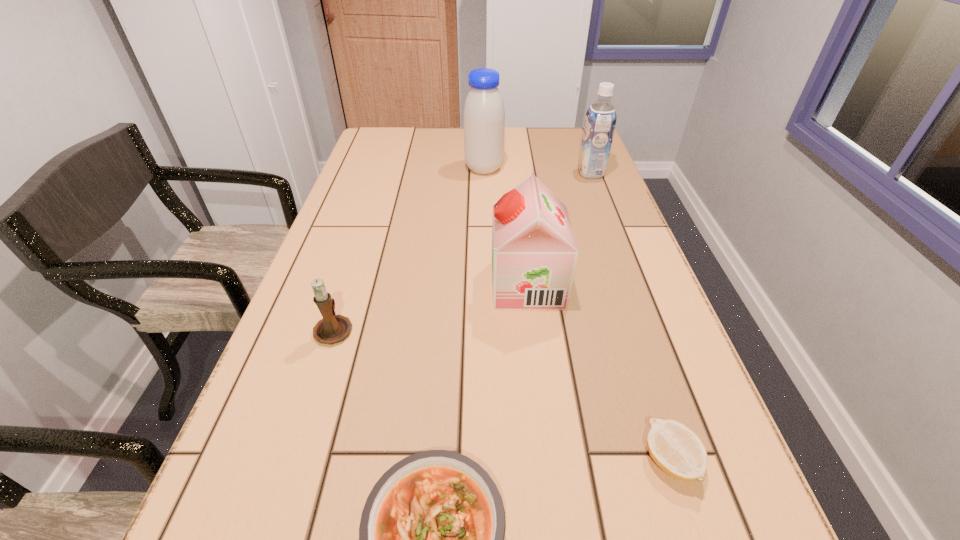
This screenshot has width=960, height=540. In order to click on vacant region at the right edge in this screenshot , I will do click(648, 265).

You are a GUI agent. You are given a task and a screenshot of the screen. Output one action in this format:
    pyautogui.click(x=<x>, y=<y>)
    Task: Click on the vacant space at the far left corner of the desktop
    
    Given the screenshot: What is the action you would take?
    pyautogui.click(x=372, y=129)

You are a GUI agent. You are given a task and a screenshot of the screen. Output one action in this format:
    pyautogui.click(x=<x>, y=<y>)
    Task: Click on the free spot between the leftmost object and the lemon
    The width and height of the screenshot is (960, 540).
    Given the screenshot: What is the action you would take?
    pyautogui.click(x=502, y=395)

This screenshot has width=960, height=540. Find the location of `free area in between the shortest object and the candle holder`. free area in between the shortest object and the candle holder is located at coordinates (502, 395).

Image resolution: width=960 pixels, height=540 pixels. Identify the location of free spot between the lemon and the candle holder. (502, 395).

Identify which object is the fourth closest to the nearest soya milk. Please provide its 2D coordinates. Your answer should be formatted as a tuple, i.e. [(x, y)], where the tuple contains the x and y coordinates of a point satisfying the conditions above.

[(484, 114)]

Where is `the closest object to the rightmost soya milk`? The image size is (960, 540). the closest object to the rightmost soya milk is located at coordinates [x=484, y=114].

You are a GUI agent. You are given a task and a screenshot of the screen. Output one action in this format:
    pyautogui.click(x=<x>, y=<y>)
    Task: Click on the soya milk that stands as the closest to the fourth tallest object
    This screenshot has height=540, width=960.
    Given the screenshot: What is the action you would take?
    pyautogui.click(x=534, y=253)

Where is `the second closest soya milk to the rightmost soya milk`? the second closest soya milk to the rightmost soya milk is located at coordinates (534, 253).

Locate an element on the screen. free region that satisfies the following two spatial constraints: 1. with the cap open on the lemon; 2. on the right side of the nearest soya milk is located at coordinates (548, 461).